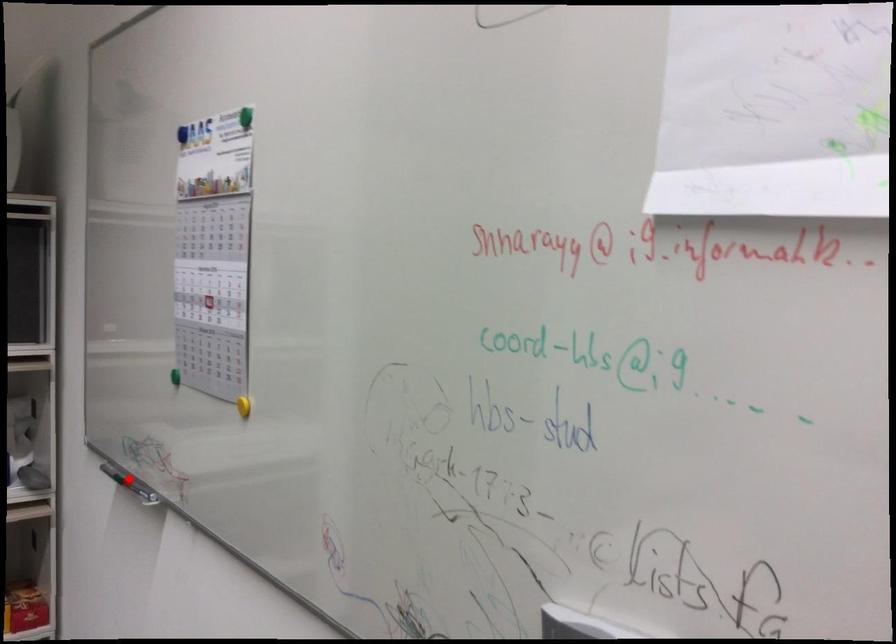
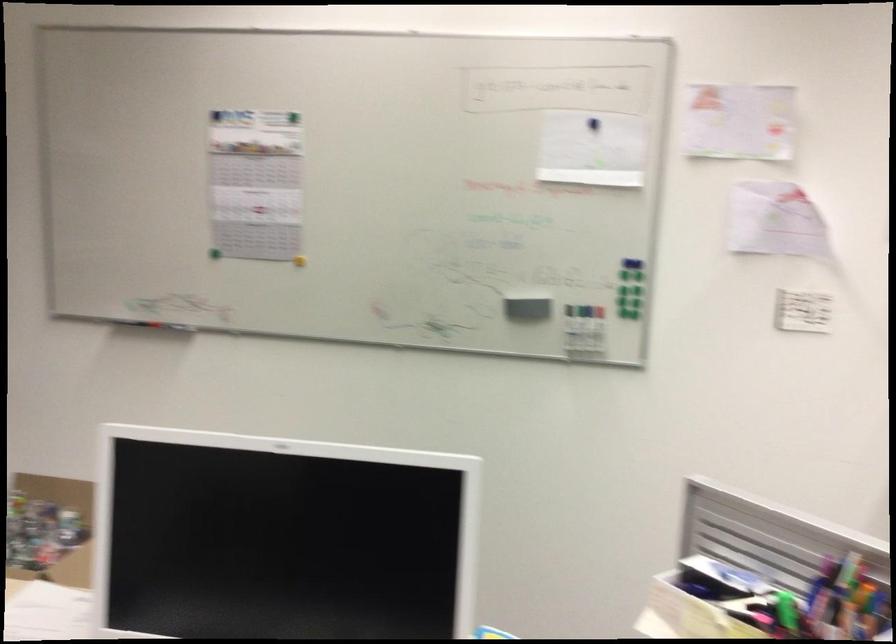
Question: I am providing you with two images of the same scene from different viewpoints. A red point is marked on the first image. Can you still see the location of the red point in image 2?

Choices:
 (A) Yes
 (B) No

Answer: (A)